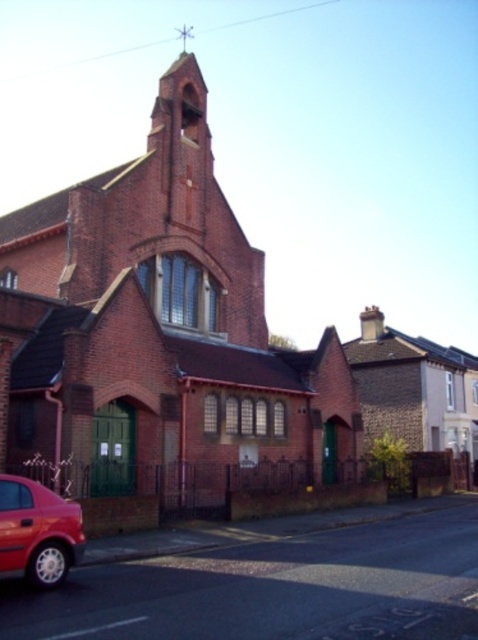
Question: Can you confirm if red brick chapel at center is positioned below shiny red car at lower left?

Choices:
 (A) yes
 (B) no

Answer: (B)

Question: From the image, what is the correct spatial relationship of red brick chapel at center in relation to shiny red car at lower left?

Choices:
 (A) right
 (B) left

Answer: (B)

Question: Which object is farther from the camera taking this photo?

Choices:
 (A) red brick chapel at center
 (B) shiny red car at lower left

Answer: (A)

Question: Is the position of red brick chapel at center less distant than that of shiny red car at lower left?

Choices:
 (A) yes
 (B) no

Answer: (B)